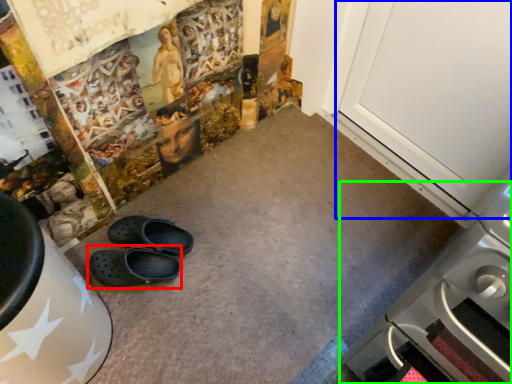
Question: Estimate the real-world distances between objects in this image. Which object is farther from footwear (highlighted by a red box), door (highlighted by a blue box) or home appliance (highlighted by a green box)?

Choices:
 (A) door
 (B) home appliance

Answer: (A)